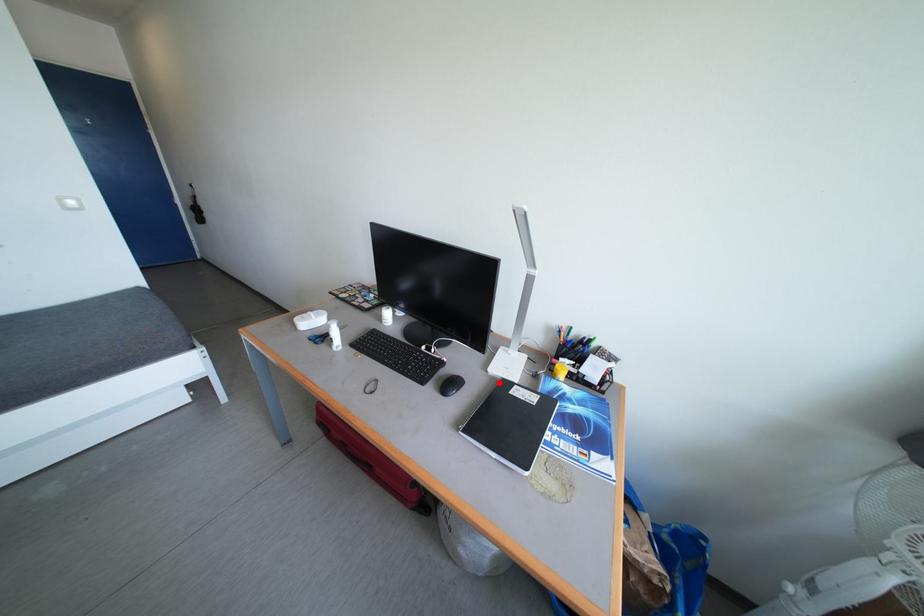
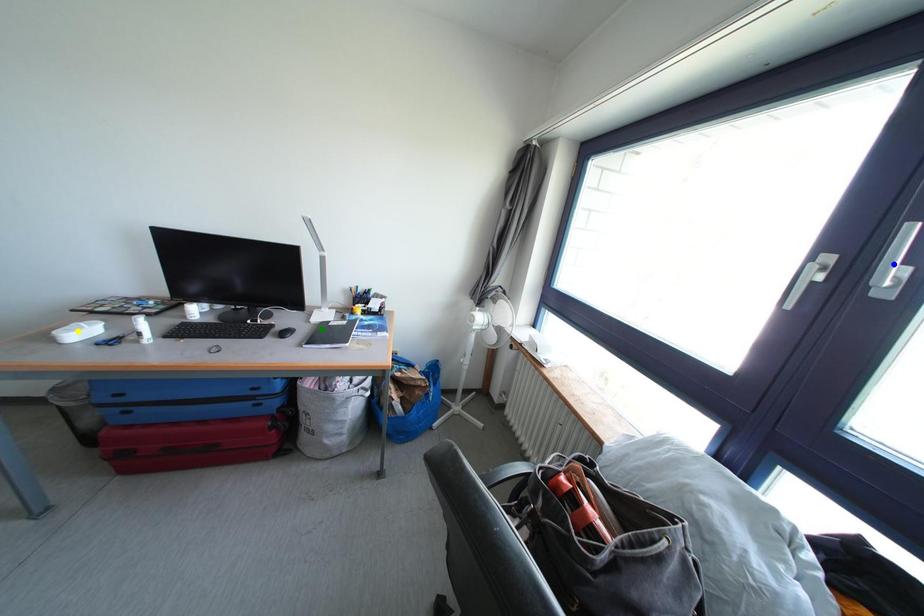
Question: I am providing you with two images of the same scene from different viewpoints. A red point is marked on the first image. You are given multiple points on the second image. Which point in image 2 is actually the same real-world point as the red point in image 1?

Choices:
 (A) blue point
 (B) yellow point
 (C) green point

Answer: (C)